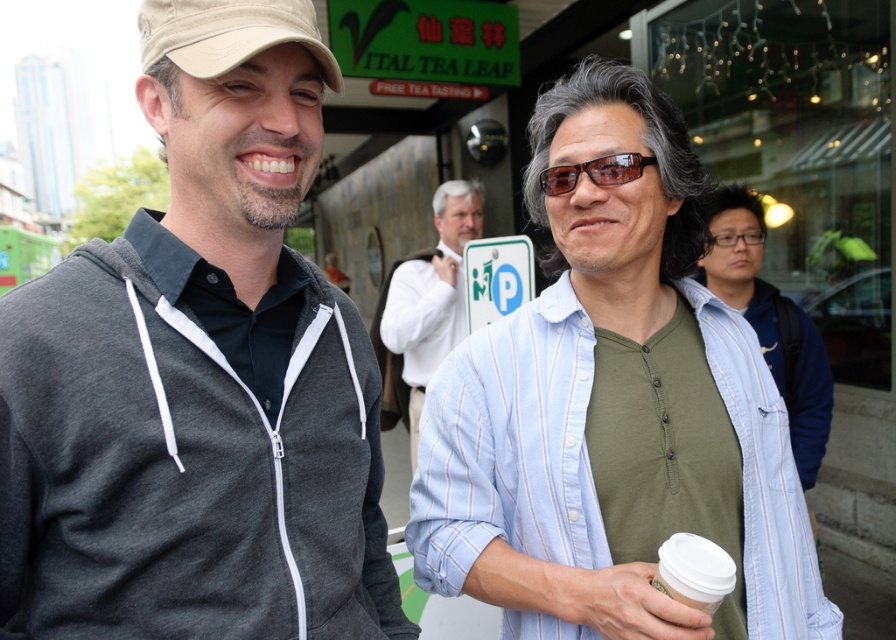
You are a photographer trying to capture a photo of the light blue striped shirt at center and the white shirt at center. Based on their positions, which one should you focus on first to ensure both are in the frame?

The light blue striped shirt at center is above the white shirt at center, so you should focus on the white shirt at center first to ensure both are in the frame.

You are a photographer trying to capture both the light blue striped shirt at center and the white shirt at center in a single frame. Since you want both shirts to be fully visible, which shirt should you focus on adjusting your camera angle to ensure it doesn???t get cropped out?

The light blue striped shirt at center is shorter than the white shirt at center, so you should focus on adjusting your camera angle to ensure the shorter light blue striped shirt at center doesn???t get cropped out.